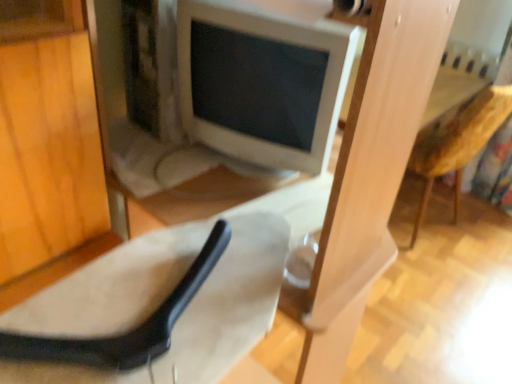
Question: Is suede-like beige chair at lower left to the left of wooden textured armchair at right from the viewer's perspective?

Choices:
 (A) no
 (B) yes

Answer: (B)

Question: Does suede-like beige chair at lower left turn towards wooden textured armchair at right?

Choices:
 (A) yes
 (B) no

Answer: (B)

Question: Can we say suede-like beige chair at lower left lies outside wooden textured armchair at right?

Choices:
 (A) no
 (B) yes

Answer: (B)

Question: Is suede-like beige chair at lower left wider than wooden textured armchair at right?

Choices:
 (A) no
 (B) yes

Answer: (A)

Question: Does suede-like beige chair at lower left come in front of wooden textured armchair at right?

Choices:
 (A) yes
 (B) no

Answer: (A)

Question: Does suede-like beige chair at lower left have a larger size compared to wooden textured armchair at right?

Choices:
 (A) yes
 (B) no

Answer: (B)

Question: Could you tell me if wooden textured armchair at right is turned towards suede-like beige chair at lower left?

Choices:
 (A) no
 (B) yes

Answer: (A)

Question: Is wooden textured armchair at right shorter than suede-like beige chair at lower left?

Choices:
 (A) yes
 (B) no

Answer: (B)

Question: Considering the relative positions of wooden textured armchair at right and suede-like beige chair at lower left in the image provided, is wooden textured armchair at right to the left of suede-like beige chair at lower left from the viewer's perspective?

Choices:
 (A) no
 (B) yes

Answer: (A)

Question: Is wooden textured armchair at right not close to suede-like beige chair at lower left?

Choices:
 (A) yes
 (B) no

Answer: (A)

Question: From the image's perspective, would you say wooden textured armchair at right is shown under suede-like beige chair at lower left?

Choices:
 (A) yes
 (B) no

Answer: (B)

Question: From the image's perspective, is wooden textured armchair at right over suede-like beige chair at lower left?

Choices:
 (A) yes
 (B) no

Answer: (A)

Question: Is wooden textured armchair at right shorter than white glossy computer monitor at center?

Choices:
 (A) no
 (B) yes

Answer: (A)